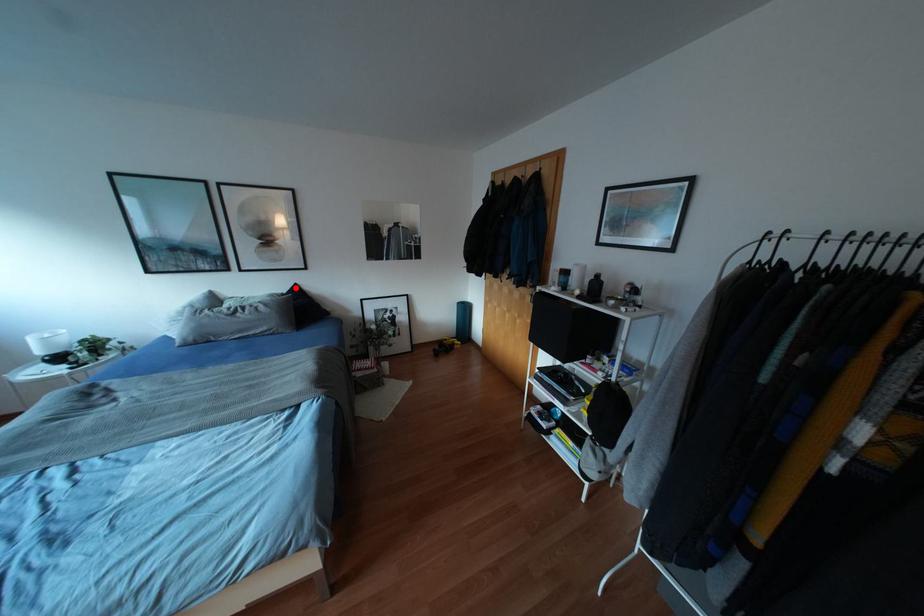
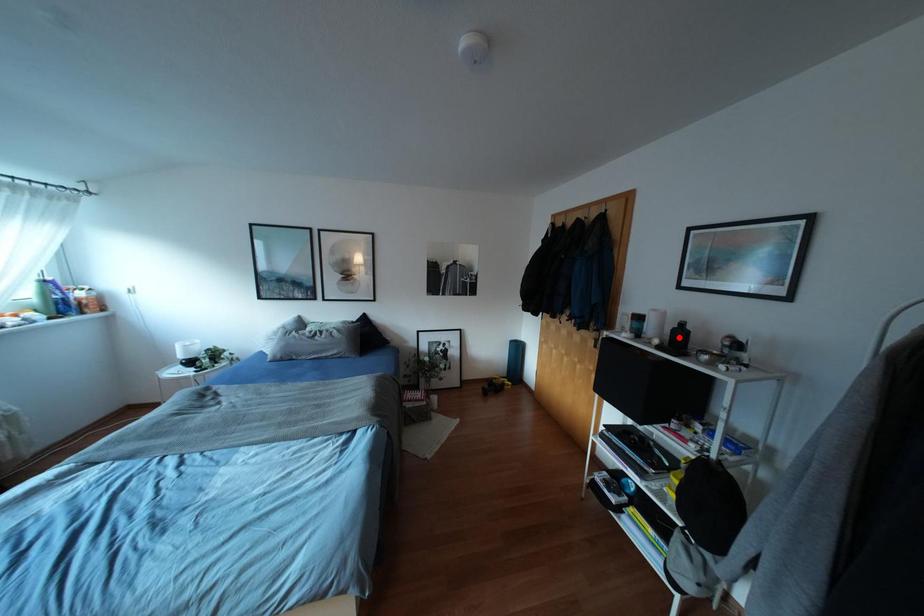
I am providing you with two images of the same scene from different viewpoints. A red point is marked on the first image and another point is marked on the second image. Does the point marked in image1 correspond to the same location as the one in image2?

No